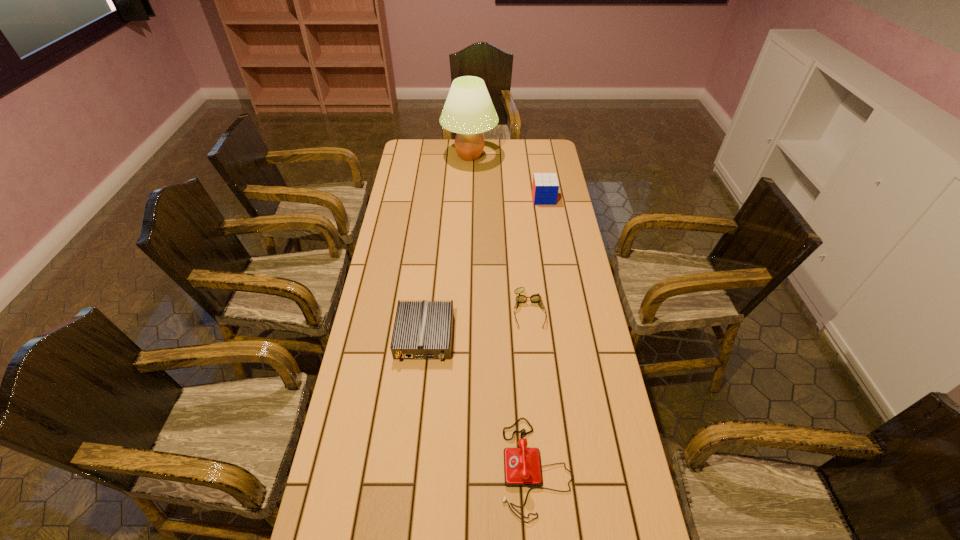
Identify the location of vacant space located on the dial of the nearest object. (441, 467).

Where is `vacant space located 0.160m on the dial of the nearest object`? The width and height of the screenshot is (960, 540). vacant space located 0.160m on the dial of the nearest object is located at coordinates (437, 467).

Image resolution: width=960 pixels, height=540 pixels. In order to click on free location located on the back panel of the router in this screenshot , I will do `click(416, 420)`.

Where is `free point located on the front-facing side of the shortest object`? This screenshot has width=960, height=540. free point located on the front-facing side of the shortest object is located at coordinates (536, 380).

Find the location of a particular element. object present at the far edge is located at coordinates (468, 111).

The height and width of the screenshot is (540, 960). In order to click on object present at the left edge in this screenshot , I will do `click(422, 330)`.

Locate an element on the screen. cube at the right edge is located at coordinates (545, 187).

Locate an element on the screen. telephone at the right edge is located at coordinates (522, 467).

Locate an element on the screen. The image size is (960, 540). spectacles located in the right edge section of the desktop is located at coordinates click(x=535, y=298).

The image size is (960, 540). In order to click on free space at the far edge in this screenshot , I will do `click(508, 148)`.